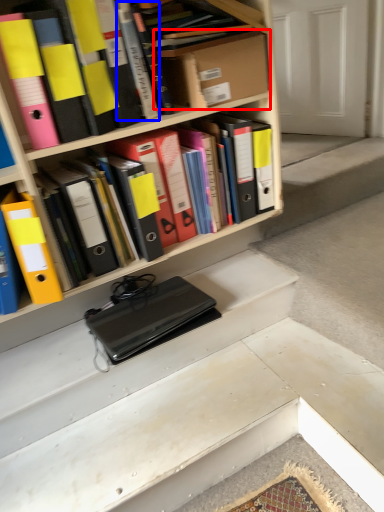
Question: Which object is further to the camera taking this photo, cardboard box (highlighted by a red box) or book (highlighted by a blue box)?

Choices:
 (A) cardboard box
 (B) book

Answer: (A)